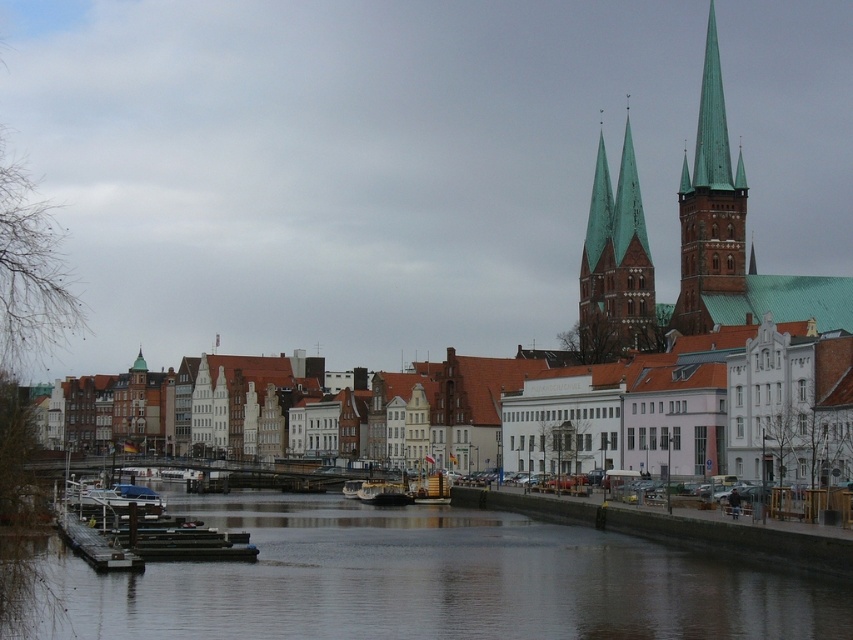
You are standing on the riverside dock and want to take a photo of the smooth concrete river at center and the metallic silver boat at center. Which object should you focus on first if you want to capture both in sharp detail?

You should focus on the smooth concrete river at center first because it is closer to the viewer than the metallic silver boat at center. By focusing on the closer object, you can ensure both are in focus as the metallic silver boat at center will be within the depth of field.

You are standing on the riverside and want to take a photo of the green copper spires at upper center and the white plastic boat at lower left. Which object should you focus on first to ensure both are in the frame?

You should focus on the green copper spires at upper center first because it is closer to you than the white plastic boat at lower left, so adjusting the camera to include it will also capture the boat in the background.

You are an architect evaluating the spatial compatibility of a new sculpture. The sculpture is 2 meters tall and needs to be placed between the green copper spires at upper center and the metallic gray barge at center. Based on the size of these objects, can the sculpture be placed there without overshadowing either structure?

The green copper spires at upper center is bigger than the metallic gray barge at center. Since the sculpture is only 2 meters tall, it would not overshadow either structure as long as it is placed appropriately between them.